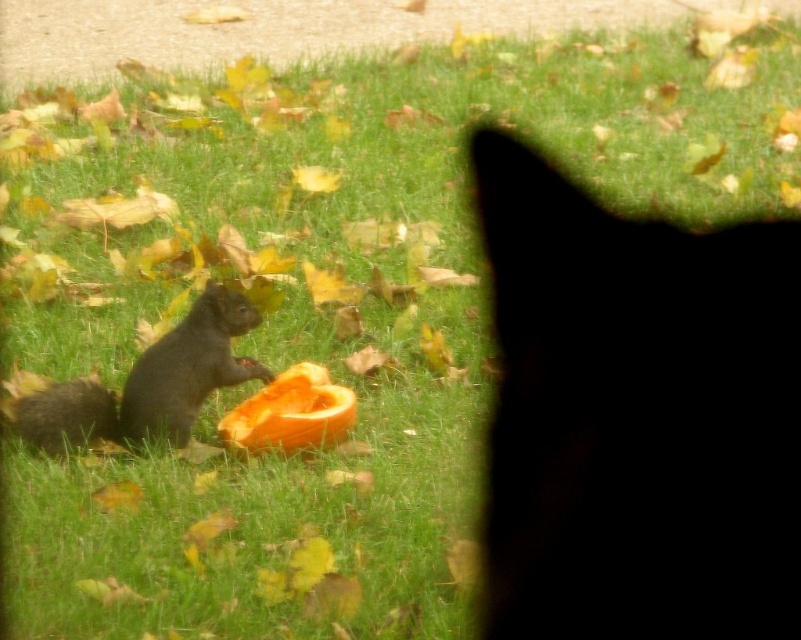
You are a photographer trying to capture the shiny brown squirrel at lower left and the black matte fur at upper right in the same frame. Which object should you focus on first if you want to ensure both are in focus?

The shiny brown squirrel at lower left should be focused on first because it is larger than the black matte fur at upper right, allowing for better depth of field adjustment.